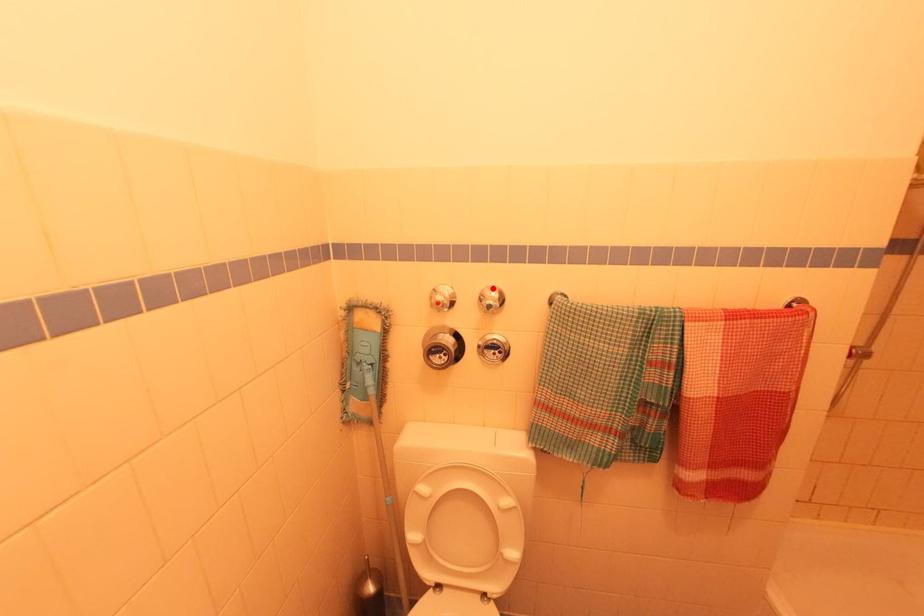
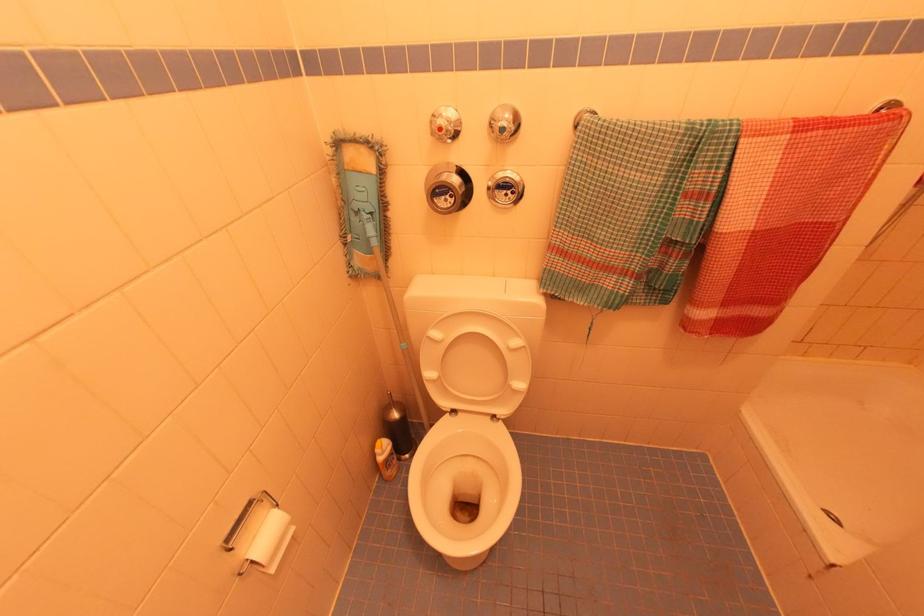
Where in the second image is the point corresponding to the highlighted location from the first image?

(505, 108)